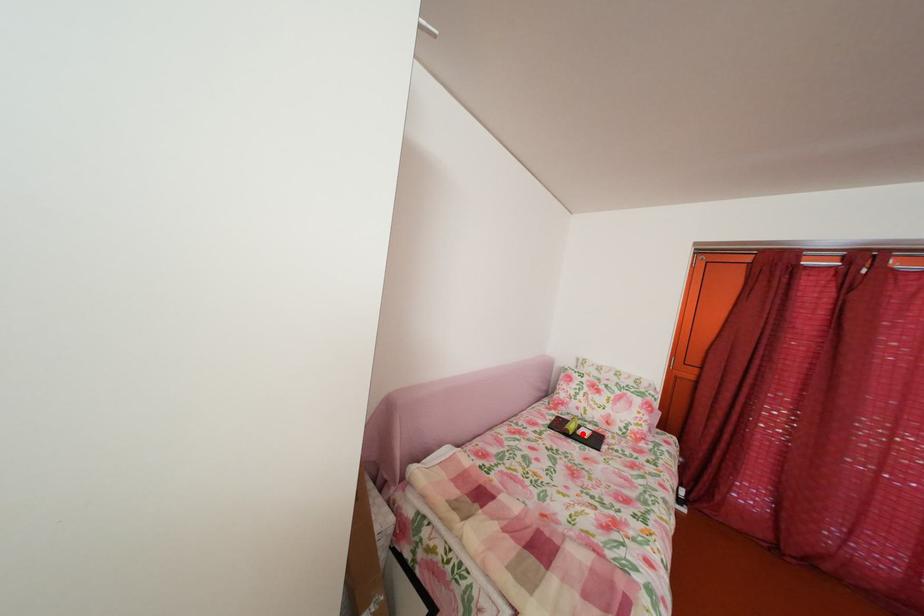
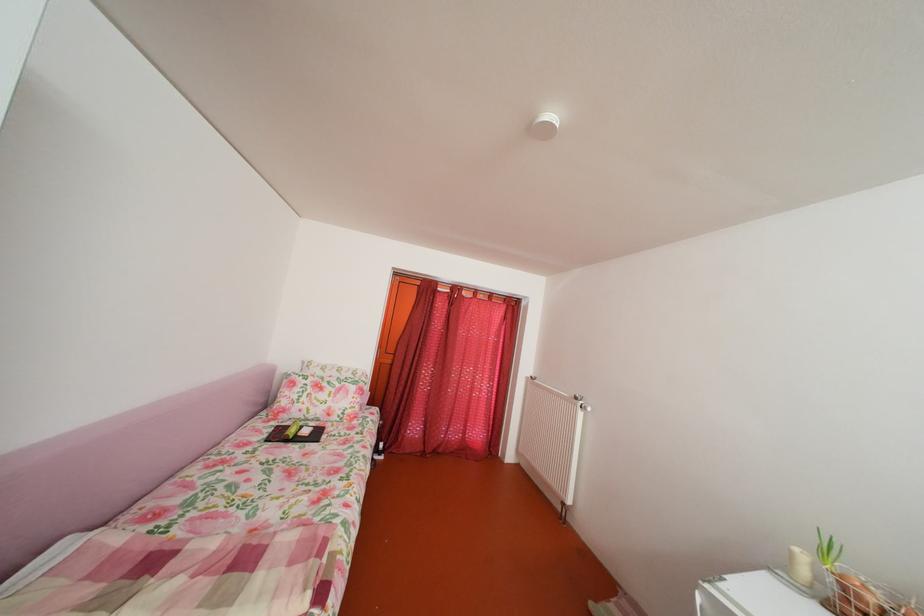
In the second image, find the point that corresponds to the highlighted location in the first image.

(304, 438)